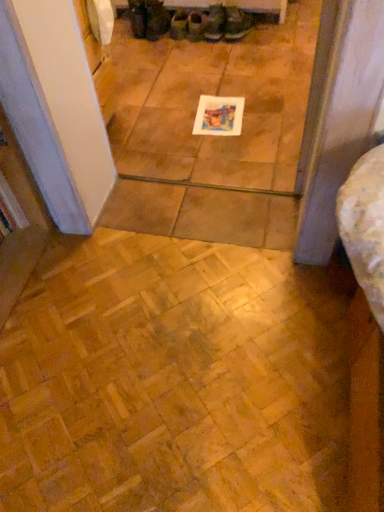
At what (x,y) coordinates should I click in order to perform the action: click on free location in front of matte black shoes at upper center, the sixth footwear from the right. Please return your answer as a coordinate pair (x, y). Looking at the image, I should click on (144, 46).